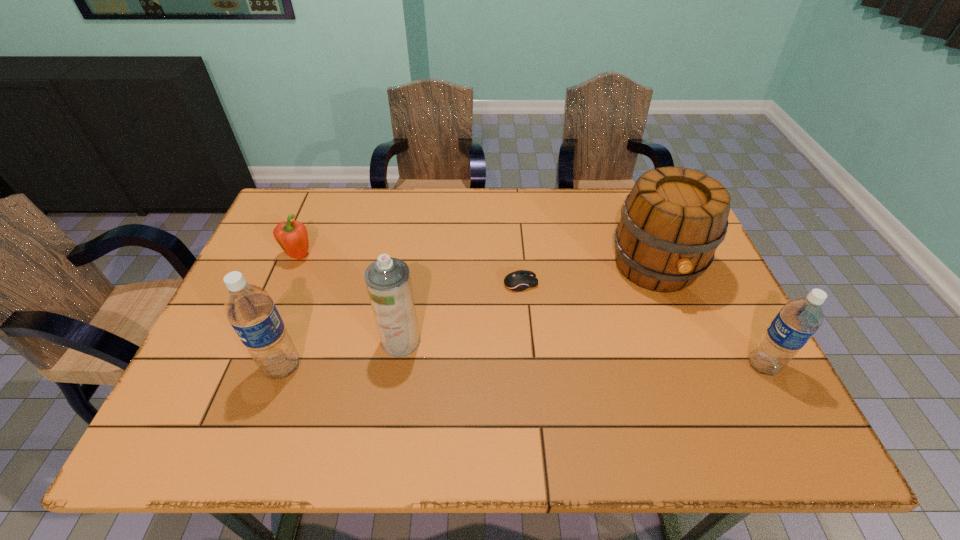
Identify the location of free space between the shorter water bottle and the taller water bottle. The image size is (960, 540). (522, 366).

Locate an element on the screen. This screenshot has height=540, width=960. free spot between the third object from right to left and the cider is located at coordinates (588, 275).

The image size is (960, 540). Find the location of `free space between the second shortest object and the third object from left to right`. free space between the second shortest object and the third object from left to right is located at coordinates (349, 299).

The image size is (960, 540). In order to click on free space between the left water bottle and the third object from left to right in this screenshot , I will do `click(342, 354)`.

I want to click on free point between the taller water bottle and the pepper, so click(291, 312).

This screenshot has height=540, width=960. In order to click on unoccupied position between the third object from right to left and the right water bottle in this screenshot , I will do [641, 325].

This screenshot has height=540, width=960. I want to click on vacant area that lies between the third object from left to right and the right water bottle, so click(x=582, y=353).

You are a GUI agent. You are given a task and a screenshot of the screen. Output one action in this format:
    pyautogui.click(x=<x>, y=<y>)
    Task: Click on the fourth closest object to the computer mouse
    This screenshot has height=540, width=960.
    Given the screenshot: What is the action you would take?
    pyautogui.click(x=250, y=310)

Locate an element on the screen. The height and width of the screenshot is (540, 960). object that is the fifth closest one to the second shortest object is located at coordinates (799, 319).

Identify the location of free location that satisfies the following two spatial constraints: 1. on the back side of the computer mouse; 2. on the right side of the taller water bottle. This screenshot has height=540, width=960. (313, 284).